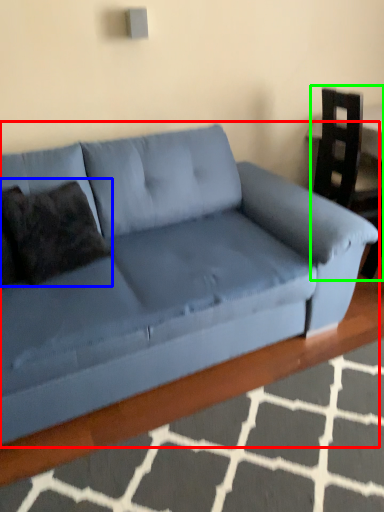
Question: Which object is the closest to the studio couch (highlighted by a red box)? Choose among these: pillow (highlighted by a blue box) or armchair (highlighted by a green box).

Choices:
 (A) pillow
 (B) armchair

Answer: (A)